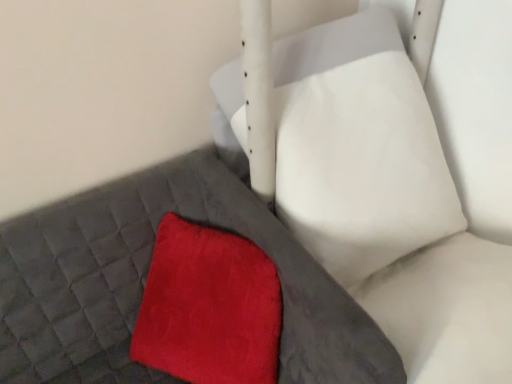
Question: Is velvety red throw pillow at center positioned far away from velvet red cushion at center?

Choices:
 (A) no
 (B) yes

Answer: (A)

Question: Is velvety red throw pillow at center bigger than velvet red cushion at center?

Choices:
 (A) yes
 (B) no

Answer: (B)

Question: Does velvety red throw pillow at center lie in front of velvet red cushion at center?

Choices:
 (A) yes
 (B) no

Answer: (B)

Question: Would you say velvet red cushion at center is part of velvety red throw pillow at center's contents?

Choices:
 (A) no
 (B) yes

Answer: (A)

Question: From a real-world perspective, does velvety red throw pillow at center stand above velvet red cushion at center?

Choices:
 (A) no
 (B) yes

Answer: (A)

Question: From a real-world perspective, is velvety red throw pillow at center positioned above or below matte gray bed frame at lower left?

Choices:
 (A) above
 (B) below

Answer: (A)

Question: Is velvety red throw pillow at center situated inside matte gray bed frame at lower left or outside?

Choices:
 (A) outside
 (B) inside

Answer: (B)

Question: Is velvety red throw pillow at center in front of or behind matte gray bed frame at lower left in the image?

Choices:
 (A) front
 (B) behind

Answer: (B)

Question: Is velvety red throw pillow at center wider or thinner than matte gray bed frame at lower left?

Choices:
 (A) thin
 (B) wide

Answer: (A)

Question: Which is correct: matte gray bed frame at lower left is inside velvety red throw pillow at center, or outside of it?

Choices:
 (A) outside
 (B) inside

Answer: (A)

Question: Is matte gray bed frame at lower left in front of or behind velvety red throw pillow at center in the image?

Choices:
 (A) behind
 (B) front

Answer: (B)

Question: Does point (154, 196) appear closer or farther from the camera than point (275, 350)?

Choices:
 (A) closer
 (B) farther

Answer: (B)

Question: From their relative heights in the image, would you say matte gray bed frame at lower left is taller or shorter than velvety red throw pillow at center?

Choices:
 (A) tall
 (B) short

Answer: (A)

Question: From a real-world perspective, is matte gray bed frame at lower left positioned above or below velvet red cushion at center?

Choices:
 (A) above
 (B) below

Answer: (B)

Question: Looking at the image, does matte gray bed frame at lower left seem bigger or smaller compared to velvet red cushion at center?

Choices:
 (A) big
 (B) small

Answer: (B)